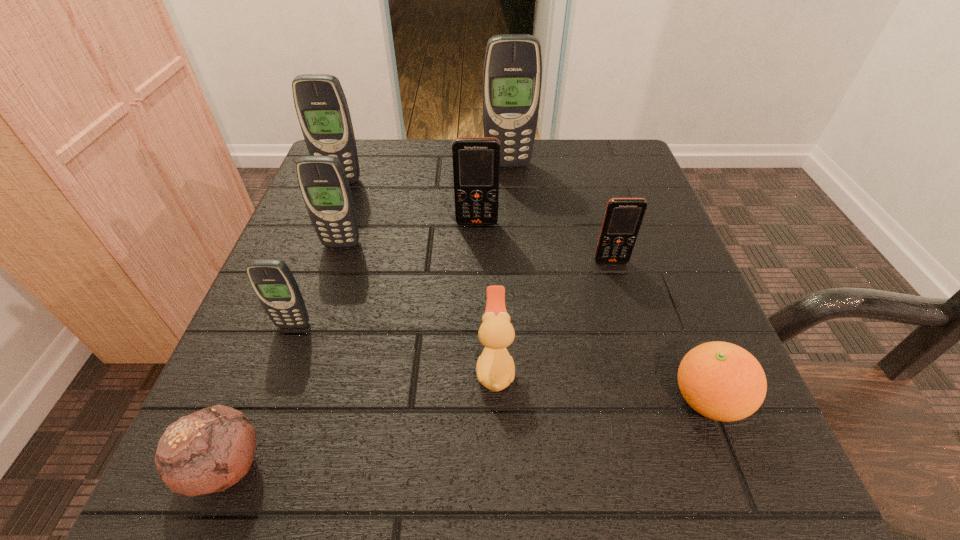
At what (x,y) coordinates should I click in order to perform the action: click on the smallest gray cellular telephone. Please return your answer as a coordinate pair (x, y). The height and width of the screenshot is (540, 960). Looking at the image, I should click on (272, 281).

Locate an element on the screen. The height and width of the screenshot is (540, 960). the nearest cellular telephone is located at coordinates (272, 281).

This screenshot has width=960, height=540. I want to click on tan duck, so click(495, 368).

Identify the location of orange. pos(722,381).

Identify the location of muffin. Image resolution: width=960 pixels, height=540 pixels. (208, 451).

Where is `vacant region located on the screen of the tallest object`? The width and height of the screenshot is (960, 540). vacant region located on the screen of the tallest object is located at coordinates (514, 231).

You are a GUI agent. You are given a task and a screenshot of the screen. Output one action in this format:
    pyautogui.click(x=<x>, y=<y>)
    Task: Click on the vacant space located 0.360m on the screen of the second tallest cellular telephone
    
    Given the screenshot: What is the action you would take?
    pyautogui.click(x=290, y=316)

Locate an element on the screen. Image resolution: width=960 pixels, height=540 pixels. vacant region located on the screen of the fourth farthest object is located at coordinates tap(333, 271).

In order to click on vacant space located on the screen of the third farthest object in this screenshot , I will do `click(476, 298)`.

Identify the location of free region located on the screen of the fifth farthest cellular telephone. (654, 407).